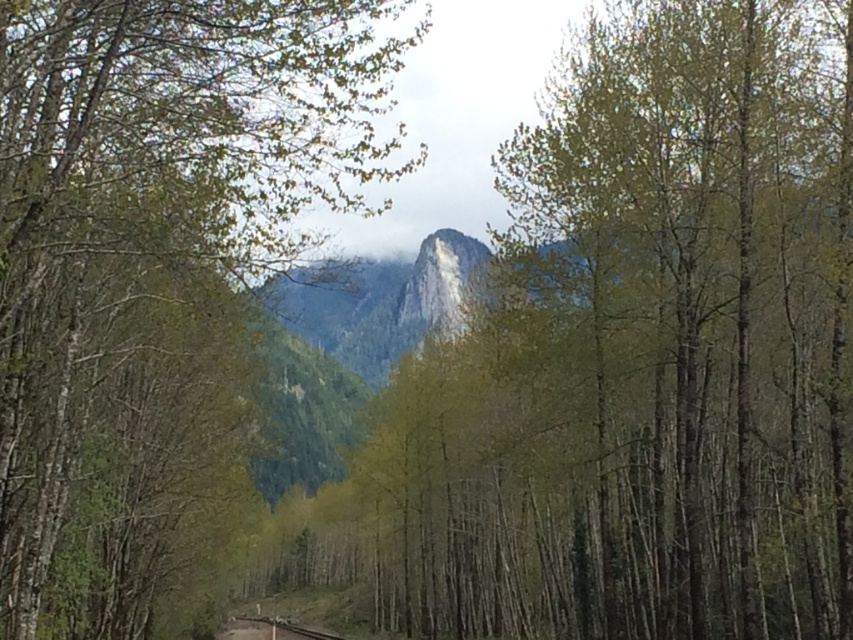
Who is higher up, green leafy tree at center or smooth metal train track at lower center?

green leafy tree at center is higher up.

What do you see at coordinates (154, 268) in the screenshot? I see `green leafy tree at center` at bounding box center [154, 268].

Is point (132, 173) in front of point (236, 620)?

Yes, point (132, 173) is closer to viewer.

You are a GUI agent. You are given a task and a screenshot of the screen. Output one action in this format:
    pyautogui.click(x=<x>, y=<y>)
    Task: Click on the green leafy tree at center
    
    Given the screenshot: What is the action you would take?
    pyautogui.click(x=154, y=268)